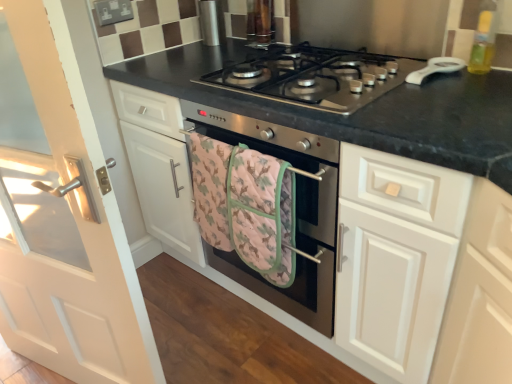
Question: Is stainless steel oven at center in front of white glossy door at left?

Choices:
 (A) yes
 (B) no

Answer: (B)

Question: Considering the relative positions of stainless steel oven at center and white glossy door at left in the image provided, is stainless steel oven at center behind white glossy door at left?

Choices:
 (A) no
 (B) yes

Answer: (B)

Question: Does stainless steel oven at center have a greater height compared to white glossy door at left?

Choices:
 (A) no
 (B) yes

Answer: (A)

Question: Is stainless steel oven at center completely or partially outside of white glossy door at left?

Choices:
 (A) yes
 (B) no

Answer: (A)

Question: From a real-world perspective, is stainless steel oven at center positioned under white glossy door at left based on gravity?

Choices:
 (A) no
 (B) yes

Answer: (B)

Question: Considering the positions of pink quilted towel at center and black granite countertop at center in the image, is pink quilted towel at center wider or thinner than black granite countertop at center?

Choices:
 (A) thin
 (B) wide

Answer: (A)

Question: Considering their positions, is pink quilted towel at center located in front of or behind black granite countertop at center?

Choices:
 (A) front
 (B) behind

Answer: (B)

Question: Which is correct: pink quilted towel at center is inside black granite countertop at center, or outside of it?

Choices:
 (A) inside
 (B) outside

Answer: (B)

Question: Does point (249, 167) appear closer or farther from the camera than point (451, 97)?

Choices:
 (A) farther
 (B) closer

Answer: (A)

Question: From a real-world perspective, is black granite countertop at center physically located above or below stainless steel gas stove at center?

Choices:
 (A) below
 (B) above

Answer: (A)

Question: From the image's perspective, is black granite countertop at center above or below stainless steel gas stove at center?

Choices:
 (A) above
 (B) below

Answer: (B)

Question: Is black granite countertop at center in front of or behind stainless steel gas stove at center in the image?

Choices:
 (A) front
 (B) behind

Answer: (A)

Question: Looking at the image, does black granite countertop at center seem bigger or smaller compared to stainless steel gas stove at center?

Choices:
 (A) small
 (B) big

Answer: (B)

Question: From a real-world perspective, relative to pink quilted towel at center, is stainless steel gas stove at center vertically above or below?

Choices:
 (A) below
 (B) above

Answer: (B)

Question: Looking at the image, does stainless steel gas stove at center seem bigger or smaller compared to pink quilted towel at center?

Choices:
 (A) small
 (B) big

Answer: (B)